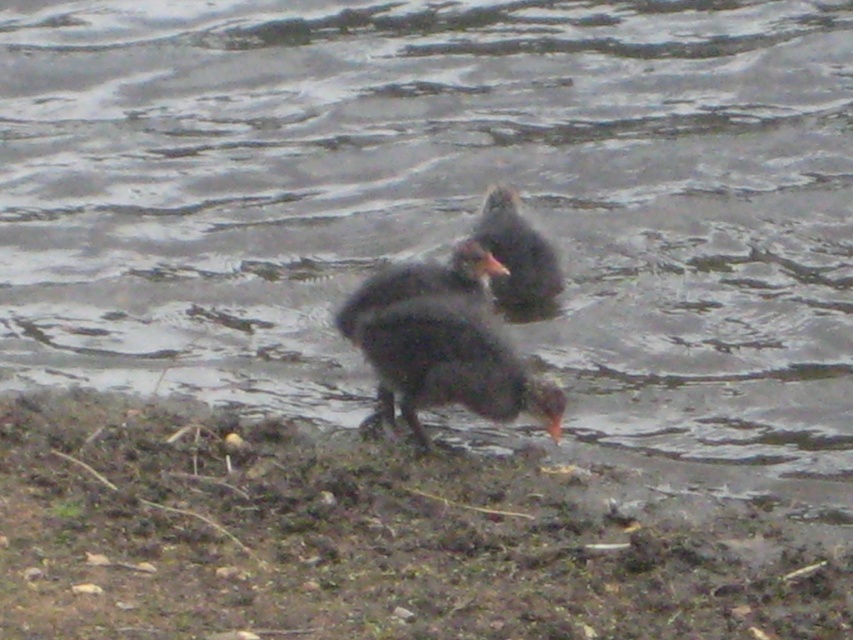
Based on the photo, you are a small insect trying to reach the dark feathered bird at center from the brown muddy ground at lower center. Can you climb up to the bird if you start from the ground?

The brown muddy ground at lower center is not as tall as dark feathered bird at center, so yes, the insect can climb up to the bird since the bird is taller than the ground.

You are a wildlife photographer aiming to capture a closeup of the dark gray feathers duck at center. Given that your camera lens has a focal length of 300mm, which is best suited for capturing distant subjects, would you need to move closer or farther away from the point at coordinates (517, 257) to get a better shot?

Since the point at coordinates (517, 257) indicates the dark gray feathers duck at center, and your camera lens has a focal length of 300mm which is best for distant subjects, you would need to move farther away from the point to utilize the lens effectively for a closeup.

You are a small insect trying to cross from the brown muddy ground at lower center to the dark feathered bird at center. Can you fit through the space between them?

The brown muddy ground at lower center might be wider than dark feathered bird at center, so the space between them may be sufficient for the insect to pass through.